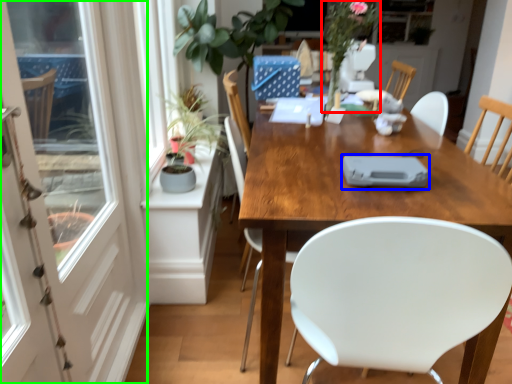
Question: Based on their relative distances, which object is farther from floral arrangement (highlighted by a red box)? Choose from tableware (highlighted by a blue box) and screen door (highlighted by a green box).

Choices:
 (A) tableware
 (B) screen door

Answer: (B)